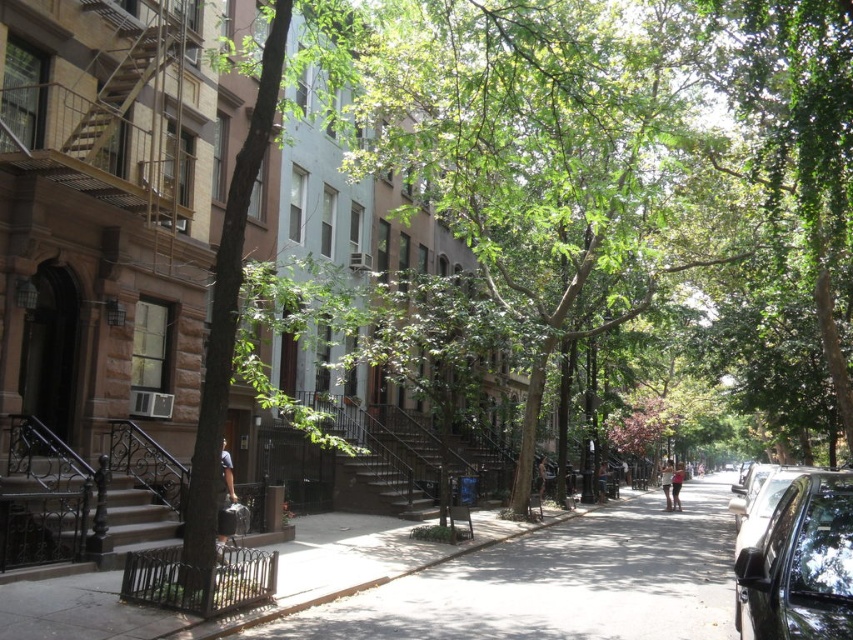
Who is more distant from viewer, (405, 412) or (172, 45)?

The point (405, 412) is more distant.

Who is lower down, black wrought iron stairs at center or metallic silver fire escape at upper left?

black wrought iron stairs at center is lower down.

Does point (387, 451) come behind point (160, 51)?

Yes, it is behind point (160, 51).

At what (x,y) coordinates should I click in order to perform the action: click on black wrought iron stairs at center. Please return your answer as a coordinate pair (x, y). This screenshot has width=853, height=640. Looking at the image, I should click on (431, 456).

Does black glossy car at right appear on the left side of metallic silver fire escape at upper left?

In fact, black glossy car at right is to the right of metallic silver fire escape at upper left.

Is point (838, 513) farther from camera compared to point (106, 100)?

That is False.

The width and height of the screenshot is (853, 640). In order to click on black glossy car at right in this screenshot , I will do `click(799, 564)`.

The image size is (853, 640). Describe the element at coordinates (120, 90) in the screenshot. I see `metallic silver fire escape at upper left` at that location.

Does metallic silver fire escape at upper left have a greater width compared to shiny black car at right?

Incorrect, metallic silver fire escape at upper left's width does not surpass shiny black car at right's.

Which is behind, point (119, 74) or point (755, 520)?

Point (119, 74)

You are a GUI agent. You are given a task and a screenshot of the screen. Output one action in this format:
    pyautogui.click(x=<x>, y=<y>)
    Task: Click on the metallic silver fire escape at upper left
    The image size is (853, 640).
    Given the screenshot: What is the action you would take?
    pyautogui.click(x=120, y=90)